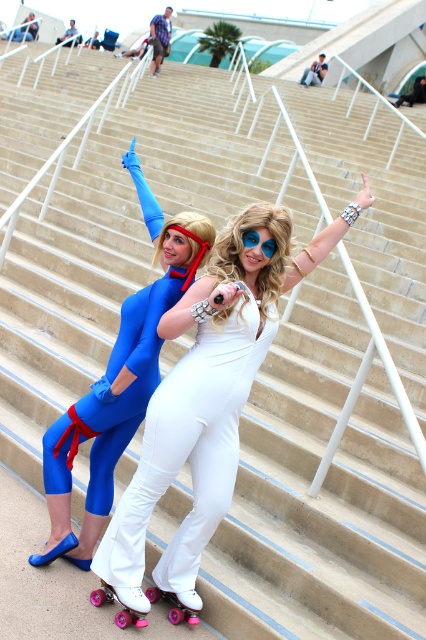
Which is more to the right, matte blue jumpsuit at left or metallic silver car at upper right?

metallic silver car at upper right is more to the right.

Which is in front, point (86, 422) or point (411, 92)?

Point (86, 422)

The image size is (426, 640). In order to click on matte blue jumpsuit at left in this screenshot , I will do `click(118, 381)`.

Does metallic silver car at upper right come in front of blue spandex suit at upper left?

No, it is not.

Does metallic silver car at upper right have a larger size compared to blue spandex suit at upper left?

No.

At what (x,y) coordinates should I click in order to perform the action: click on metallic silver car at upper right. Please return your answer as a coordinate pair (x, y). Image resolution: width=426 pixels, height=640 pixels. Looking at the image, I should click on 414,93.

You are a GUI agent. You are given a task and a screenshot of the screen. Output one action in this format:
    pyautogui.click(x=<x>, y=<y>)
    Task: Click on the metallic silver car at upper right
    
    Given the screenshot: What is the action you would take?
    pyautogui.click(x=414, y=93)

Is matte blue jumpsuit at left to the left of brushed metal water at bottle left from the viewer's perspective?

In fact, matte blue jumpsuit at left is to the right of brushed metal water at bottle left.

Between matte blue jumpsuit at left and brushed metal water at bottle left, which one appears on the left side from the viewer's perspective?

brushed metal water at bottle left is more to the left.

Does point (166, 298) come in front of point (152, 60)?

Yes, it is in front of point (152, 60).

Find the location of a particular element. The width and height of the screenshot is (426, 640). matte blue jumpsuit at left is located at coordinates (118, 381).